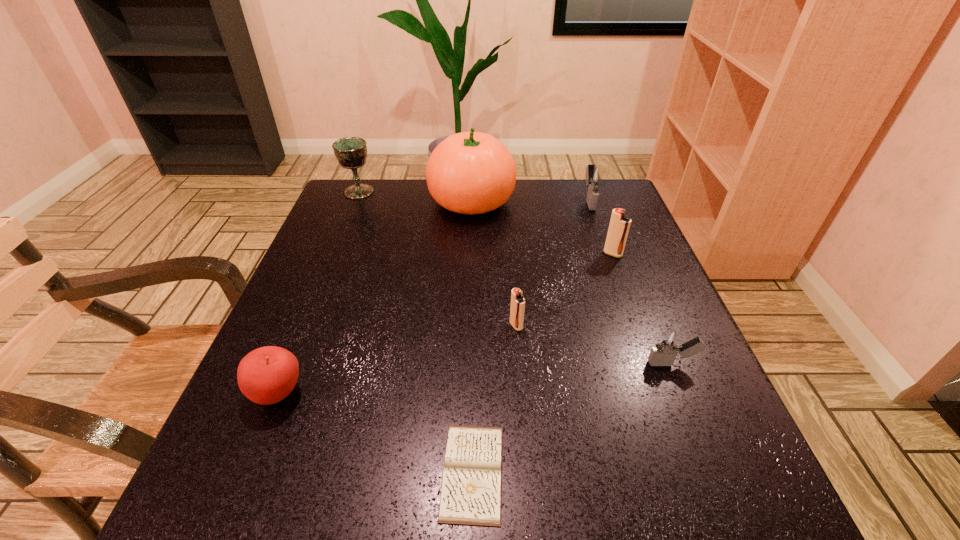
The image size is (960, 540). I want to click on the nearest igniter, so click(x=667, y=346).

Where is `diary`? This screenshot has width=960, height=540. diary is located at coordinates (471, 491).

Find the location of a particular element. This screenshot has width=960, height=540. the shortest object is located at coordinates (471, 491).

Image resolution: width=960 pixels, height=540 pixels. Identify the location of vacant space located on the front of the tallest object. (468, 299).

Find the location of `blank space located 0.080m on the front of the chalice`. blank space located 0.080m on the front of the chalice is located at coordinates (349, 216).

This screenshot has height=540, width=960. In order to click on vacant area situated 0.230m on the front of the farthest igniter in this screenshot , I will do `click(612, 267)`.

The image size is (960, 540). In order to click on free region located 0.340m on the left of the farther red igniter in this screenshot , I will do `click(459, 254)`.

Find the location of a particular element. The width and height of the screenshot is (960, 540). free space located on the right of the apple is located at coordinates tap(388, 394).

Find the location of a particular element. This screenshot has width=960, height=540. vacant area situated on the back of the third farthest igniter is located at coordinates (510, 247).

Where is `free space located on the back of the nearest igniter`? free space located on the back of the nearest igniter is located at coordinates (652, 314).